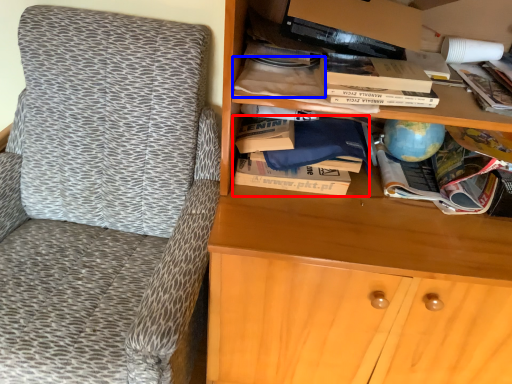
Question: Which object is closer to the camera taking this photo, book (highlighted by a red box) or book (highlighted by a blue box)?

Choices:
 (A) book
 (B) book

Answer: (B)